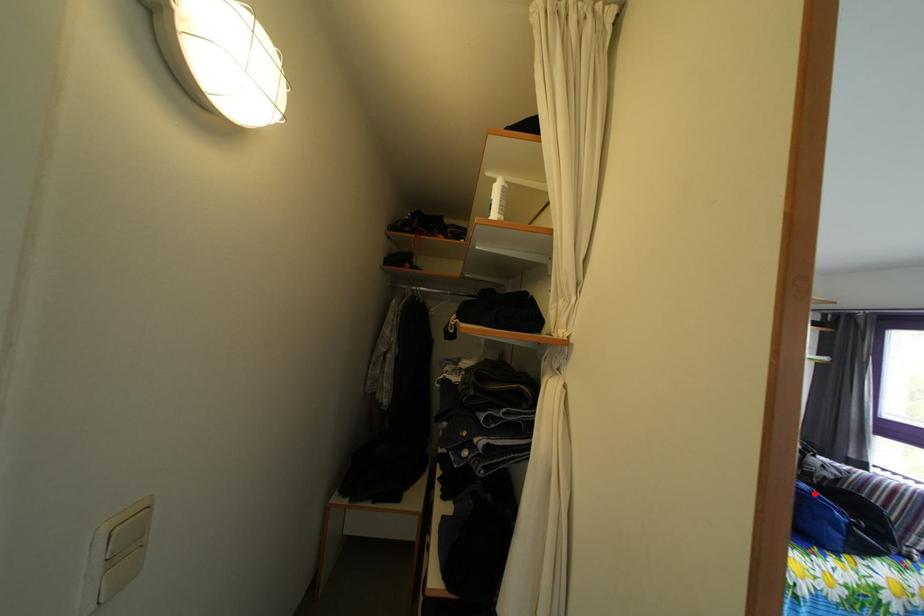
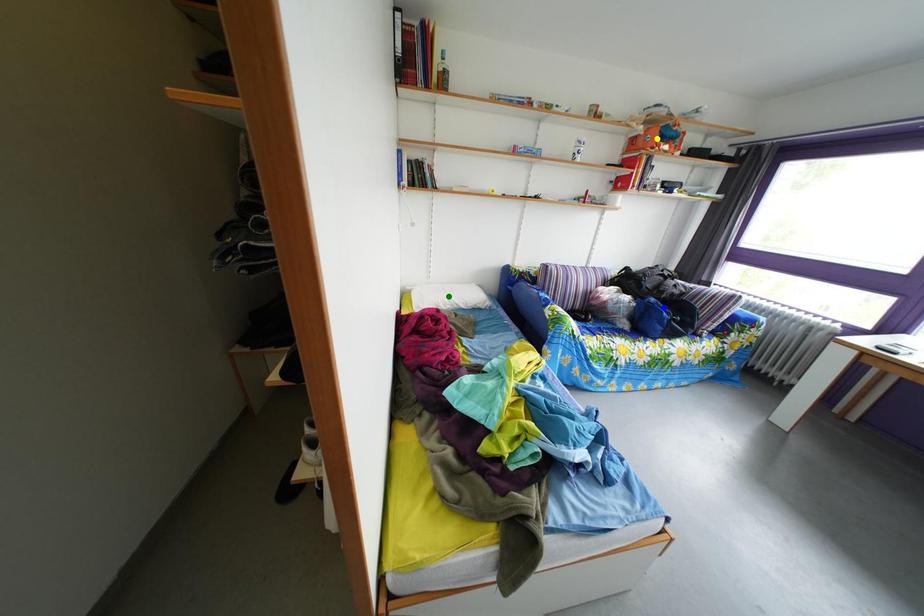
Question: I am providing you with two images of the same scene from different viewpoints. A red point is marked on the first image. You are given multiple points on the second image. Can you choose the point in image 2 that corresponds to the point in image 1?

Choices:
 (A) blue point
 (B) yellow point
 (C) green point

Answer: (A)